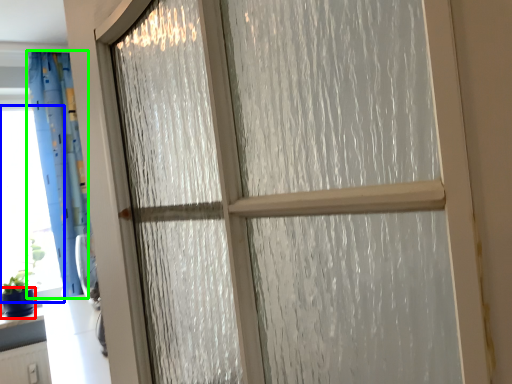
Question: Estimate the real-world distances between objects in this image. Which object is farther from glass vase (highlighted by a red box), window screen (highlighted by a blue box) or curtain (highlighted by a green box)?

Choices:
 (A) window screen
 (B) curtain

Answer: (B)